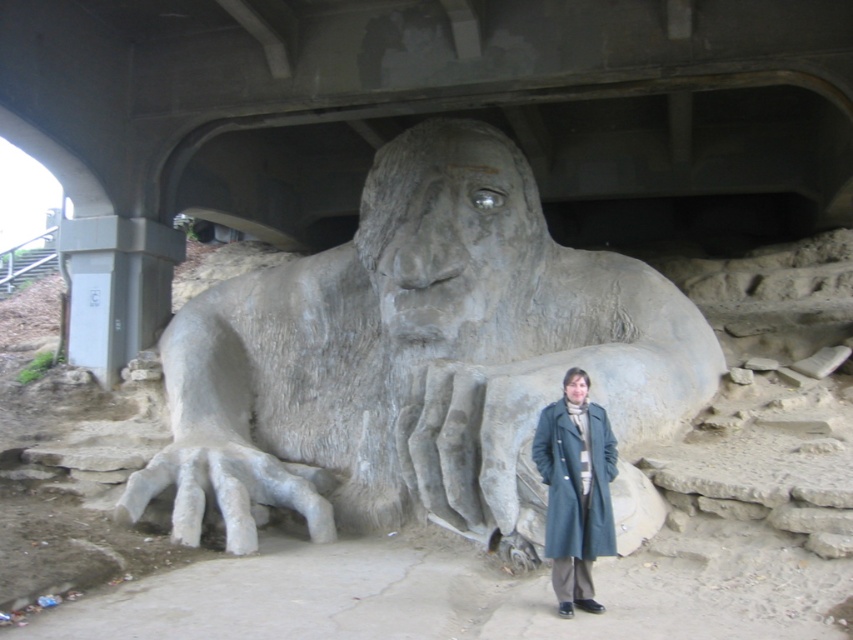
Question: Is gray stone statue at center closer to camera compared to matte gray coat at lower right?

Choices:
 (A) no
 (B) yes

Answer: (A)

Question: Is gray stone statue at center behind matte gray coat at lower right?

Choices:
 (A) no
 (B) yes

Answer: (B)

Question: Does gray stone statue at center have a larger size compared to matte gray coat at lower right?

Choices:
 (A) no
 (B) yes

Answer: (B)

Question: Which of the following is the closest to the observer?

Choices:
 (A) (595, 410)
 (B) (705, 397)

Answer: (A)

Question: Which object is farther from the camera taking this photo?

Choices:
 (A) gray stone statue at center
 (B) matte gray coat at lower right

Answer: (A)